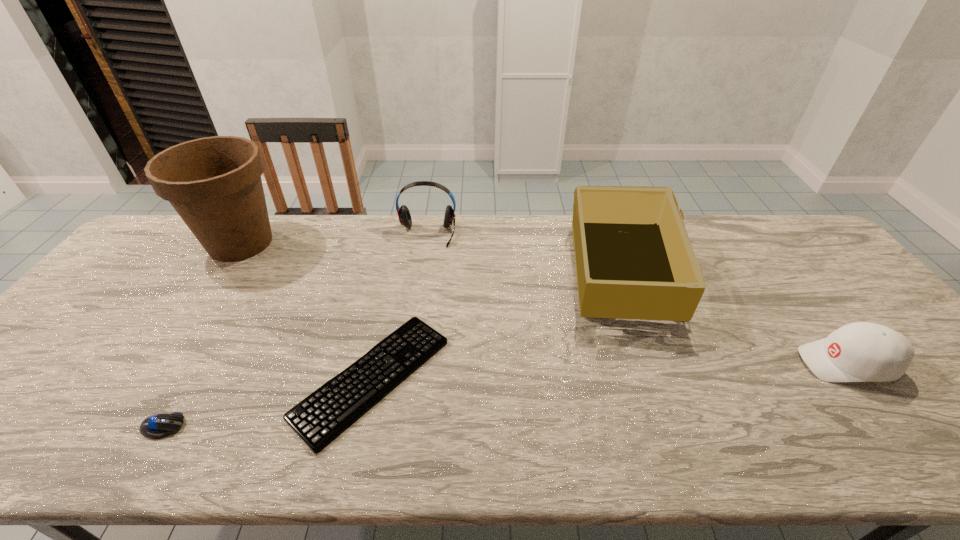
Find the location of a particular element. vacant space that's between the computer keyboard and the headset is located at coordinates (399, 306).

You are a GUI agent. You are given a task and a screenshot of the screen. Output one action in this format:
    pyautogui.click(x=<x>, y=<y>)
    Task: Click on the vacant space that is in between the headset and the flowerpot
    
    Given the screenshot: What is the action you would take?
    pyautogui.click(x=334, y=239)

Identify the location of vacant area that lies between the box and the computer keyboard. The height and width of the screenshot is (540, 960). (496, 324).

The height and width of the screenshot is (540, 960). I want to click on free spot between the second object from right to left and the computer keyboard, so click(496, 324).

Identify the location of vacant area that lies between the fourth tallest object and the box. (733, 316).

Find the location of a particular element. object that is the third closest to the flowerpot is located at coordinates (160, 425).

In order to click on the fifth closest object to the fifth object from left to right in this screenshot , I will do `click(160, 425)`.

Locate an element on the screen. This screenshot has height=540, width=960. free spot that satisfies the following two spatial constraints: 1. with the microphone attached to the side of the headset; 2. on the button side of the computer mouse is located at coordinates (398, 427).